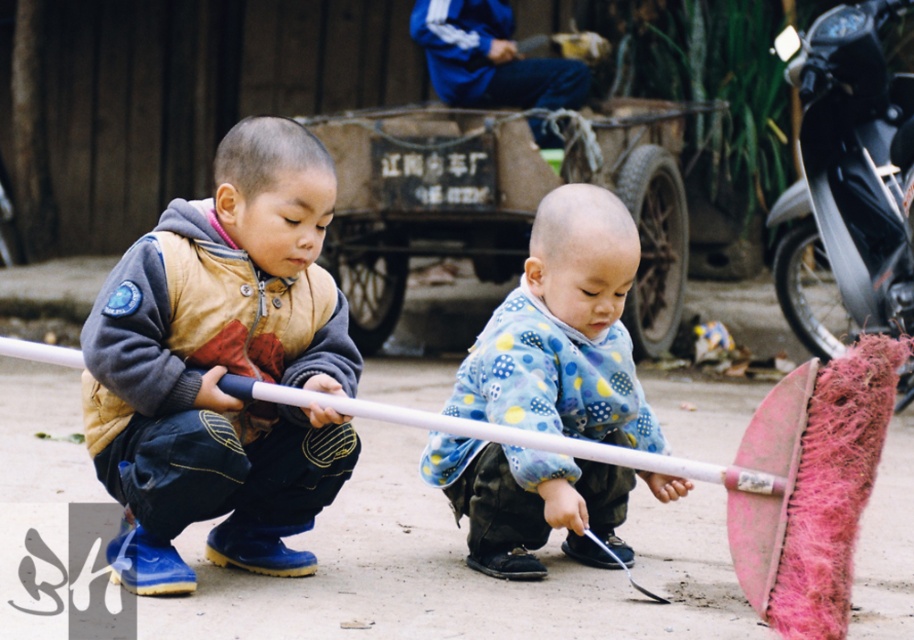
Question: Which object is the farthest from the brown suede jacket at center?

Choices:
 (A) rusty metal wagon at center
 (B) blue fleece jacket at center

Answer: (A)

Question: Does brown suede jacket at center appear under blue fleece jacket at center?

Choices:
 (A) no
 (B) yes

Answer: (A)

Question: Which of the following is the farthest from the observer?

Choices:
 (A) brown suede jacket at center
 (B) rusty metal wagon at center
 (C) blue fleece jacket at center

Answer: (B)

Question: Does rusty metal wagon at center lie behind blue fleece jacket at center?

Choices:
 (A) yes
 (B) no

Answer: (A)

Question: Which is farther from the brown suede jacket at center?

Choices:
 (A) rusty metal wagon at center
 (B) blue fleece jacket at center

Answer: (A)

Question: Observing the image, what is the correct spatial positioning of rusty metal wagon at center in reference to blue fleece jacket at center?

Choices:
 (A) left
 (B) right

Answer: (B)